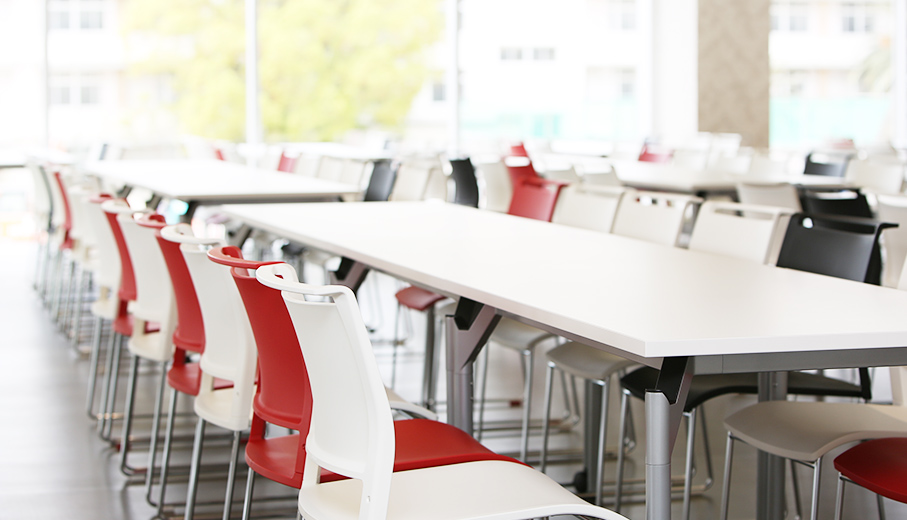
Identify the location of black chair. (382, 170), (461, 176), (824, 169), (842, 200), (844, 253).